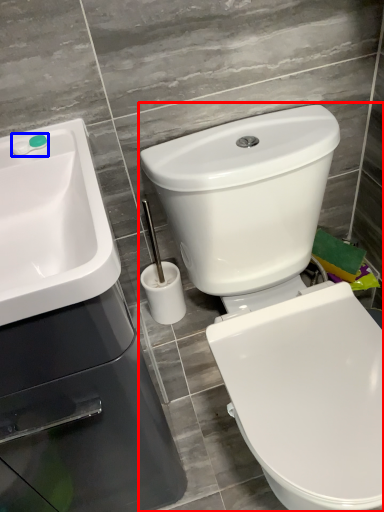
Question: Which of the following is the closest to the observer, toilet (highlighted by a red box) or plumbing fixture (highlighted by a blue box)?

Choices:
 (A) toilet
 (B) plumbing fixture

Answer: (A)